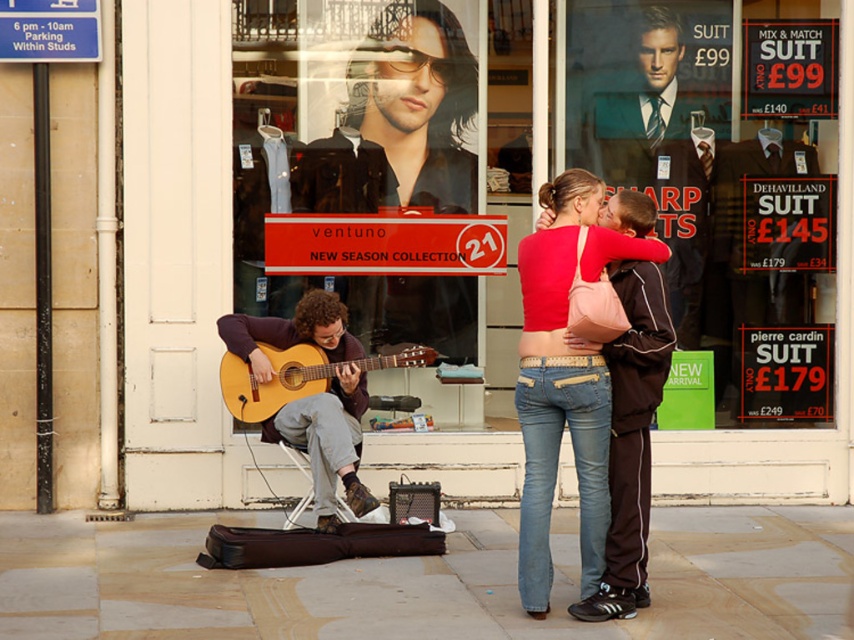
Question: Is matte black guitar at center to the right of acoustic wood guitar at center from the viewer's perspective?

Choices:
 (A) no
 (B) yes

Answer: (B)

Question: Is matte black guitar at center wider than denim jeans at center?

Choices:
 (A) no
 (B) yes

Answer: (B)

Question: Which object is closer to the camera taking this photo?

Choices:
 (A) acoustic guitar at center
 (B) denim jeans at center

Answer: (B)

Question: Which point is farther from the camera taking this photo?

Choices:
 (A) (624, 92)
 (B) (254, 268)
 (C) (570, 339)

Answer: (A)

Question: Which object is the closest to the acoustic wood guitar at center?

Choices:
 (A) denim jeans at center
 (B) brown leather guitar case at lower center

Answer: (B)

Question: Is glass display at center below matte black guitar at center?

Choices:
 (A) yes
 (B) no

Answer: (B)